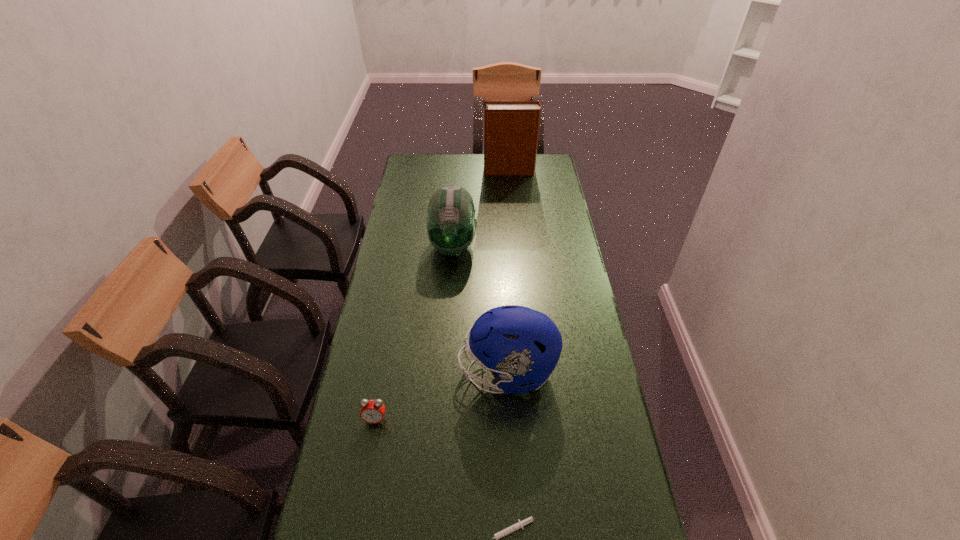
The width and height of the screenshot is (960, 540). In order to click on vacant area that satisfies the following two spatial constraints: 1. on the face guard of the nearer football helmet; 2. on the front-facing side of the leftmost object in this screenshot , I will do `click(510, 419)`.